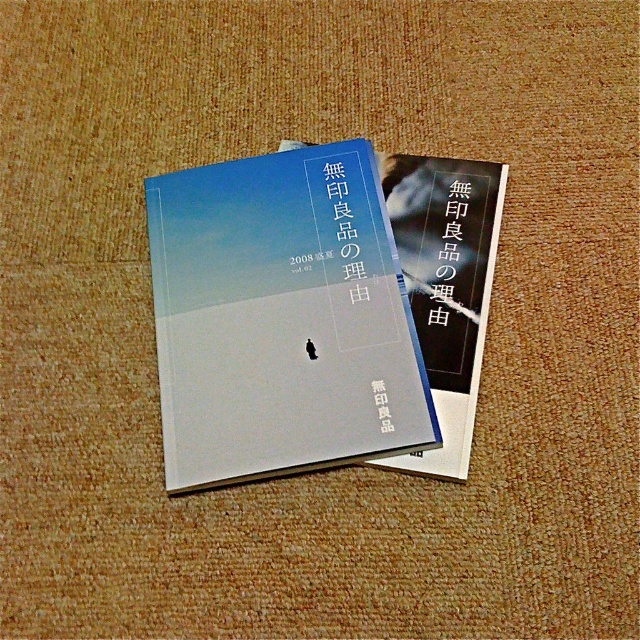
You are organizing a bookshelf and have two books in front of you. You need to place them side by side. The matte paper book at center has a certain size compared to the matte black book at center. Which book should you place on the left to ensure there is enough space for both?

The matte paper book at center is bigger than the matte black book at center, so place the matte black book at center on the left to leave more space for the larger matte paper book at center on the right.

You are organizing a bookshelf and need to place the matte paper book at center and the matte black book at center side by side. Given that the shelf has a width of 30 cm, can both books fit if there needs to be at least 2 cm of space between them?

The matte paper book at center is wider than the matte black book at center. However, without knowing their exact widths, it is impossible to determine if both can fit on a 30 cm shelf with 2 cm of space between them.

You are organizing a bookshelf and need to place both the matte paper book at center and the matte black book at center vertically. Given that the shelf has a height limit of 15 cm, can both books fit side by side vertically without exceeding the height limit?

The matte paper book at center is taller than the matte black book at center. However, since the exact heights are not provided, we cannot determine if their combined height exceeds the 15 cm limit. Additional measurements are needed.